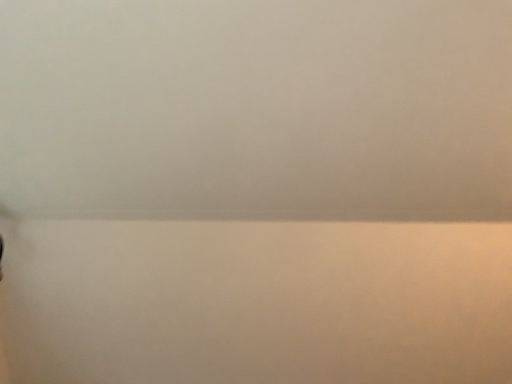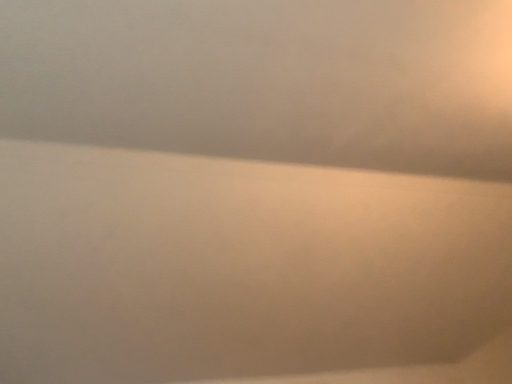
Question: How did the camera likely rotate when shooting the video?

Choices:
 (A) rotated upward
 (B) rotated downward

Answer: (B)